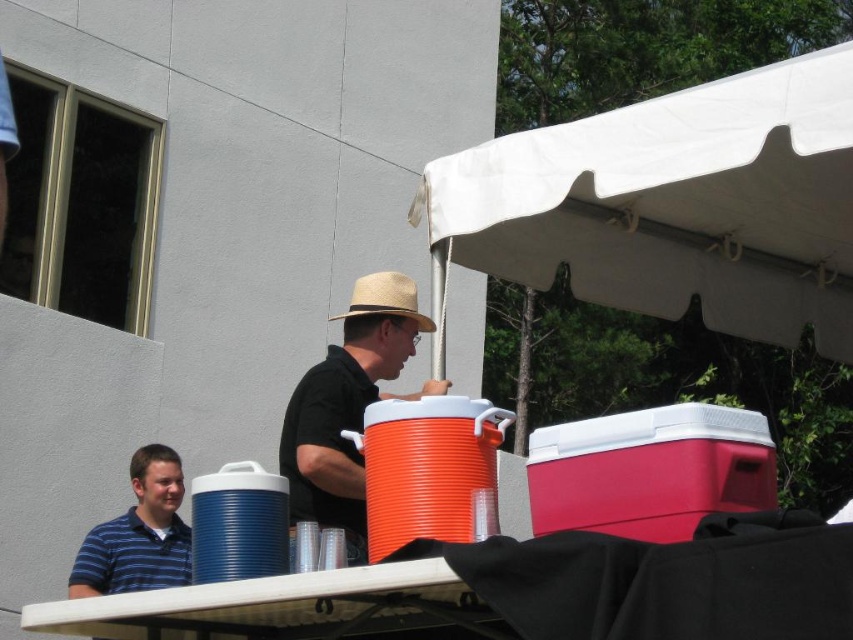
Consider the image. Who is more forward, (381,337) or (125,515)?

Positioned in front is point (381,337).

Is matte straw hat at center smaller than blue striped shirt at lower left?

Yes, matte straw hat at center is smaller than blue striped shirt at lower left.

Between point (403, 323) and point (107, 529), which one is positioned in front?

Point (403, 323)

Find the location of `matte straw hat at center`. matte straw hat at center is located at coordinates (347, 404).

Who is shorter, blue striped shirt at lower left or strawhat at center?

strawhat at center is shorter.

Describe the element at coordinates (138, 534) in the screenshot. The height and width of the screenshot is (640, 853). I see `blue striped shirt at lower left` at that location.

Identify the location of blue striped shirt at lower left. (138, 534).

Can you confirm if white plastic table at lower center is positioned below strawhat at center?

Yes.

Does white plastic table at lower center lie in front of strawhat at center?

Yes, it is.

You are a GUI agent. You are given a task and a screenshot of the screen. Output one action in this format:
    pyautogui.click(x=<x>, y=<y>)
    Task: Click on the white plastic table at lower center
    This screenshot has height=640, width=853.
    Given the screenshot: What is the action you would take?
    (x=280, y=605)